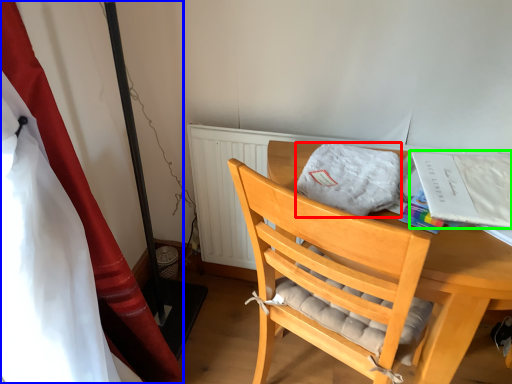
Question: Estimate the real-world distances between objects in this image. Which object is closer to cloth (highlighted by a red box), curtain (highlighted by a blue box) or magazine (highlighted by a green box)?

Choices:
 (A) curtain
 (B) magazine

Answer: (B)